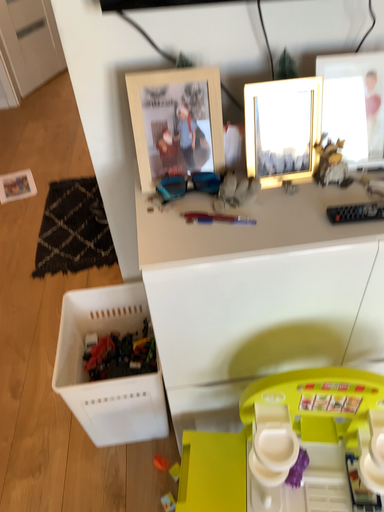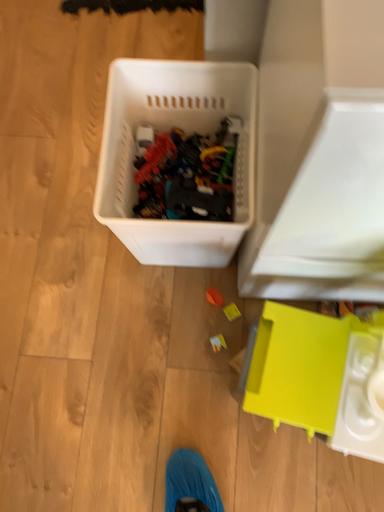
Question: Which way did the camera rotate in the video?

Choices:
 (A) rotated downward
 (B) rotated upward

Answer: (A)